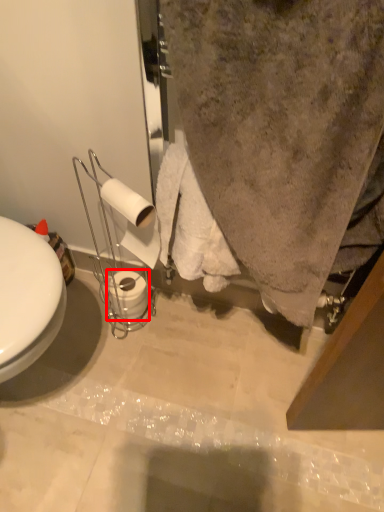
Question: Considering the relative positions of toilet paper (annotated by the red box) and toilet paper in the image provided, where is toilet paper (annotated by the red box) located with respect to the staircase?

Choices:
 (A) left
 (B) right

Answer: (A)